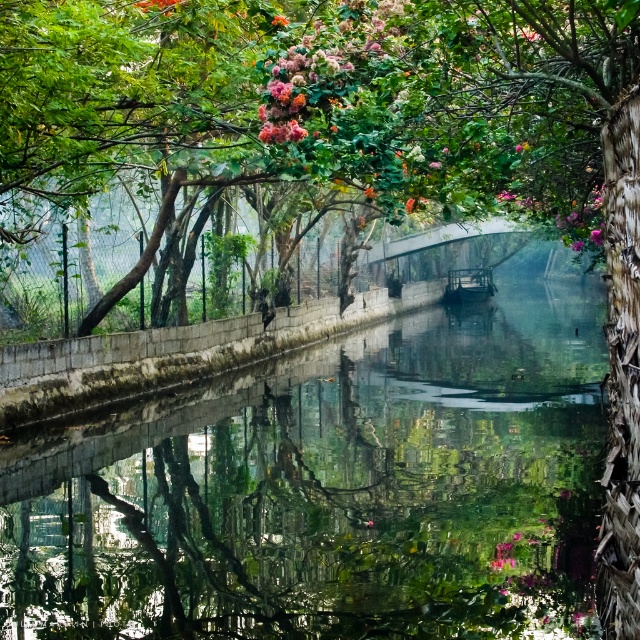
Question: Can you confirm if pink matte flower at upper right is bigger than pink matte flower at upper center?

Choices:
 (A) no
 (B) yes

Answer: (A)

Question: Considering the real-world distances, which object is farthest from the pink fluffy flowers at upper center?

Choices:
 (A) pink matte flower at upper right
 (B) pink matte flower at upper center

Answer: (A)

Question: Which point appears farthest from the camera in this image?

Choices:
 (A) (340, 115)
 (B) (586, 212)
 (C) (136, 3)

Answer: (B)

Question: Which of the following is the farthest from the observer?

Choices:
 (A) pink matte flower at upper right
 (B) pink fluffy flowers at upper center

Answer: (A)

Question: Does pink fluffy flowers at upper center come in front of pink matte flower at upper center?

Choices:
 (A) yes
 (B) no

Answer: (A)

Question: In this image, where is pink fluffy flowers at upper center located relative to pink matte flower at upper right?

Choices:
 (A) below
 (B) above

Answer: (B)